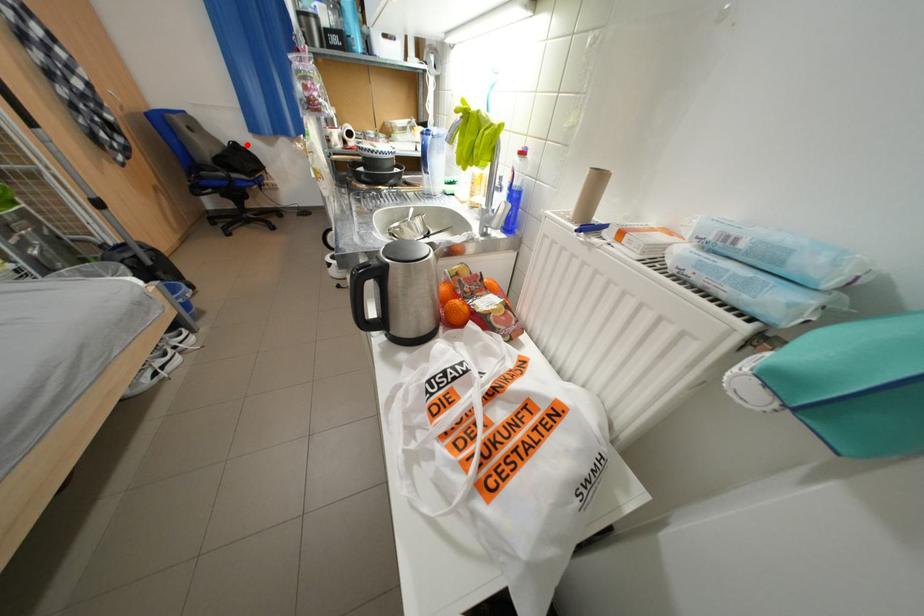
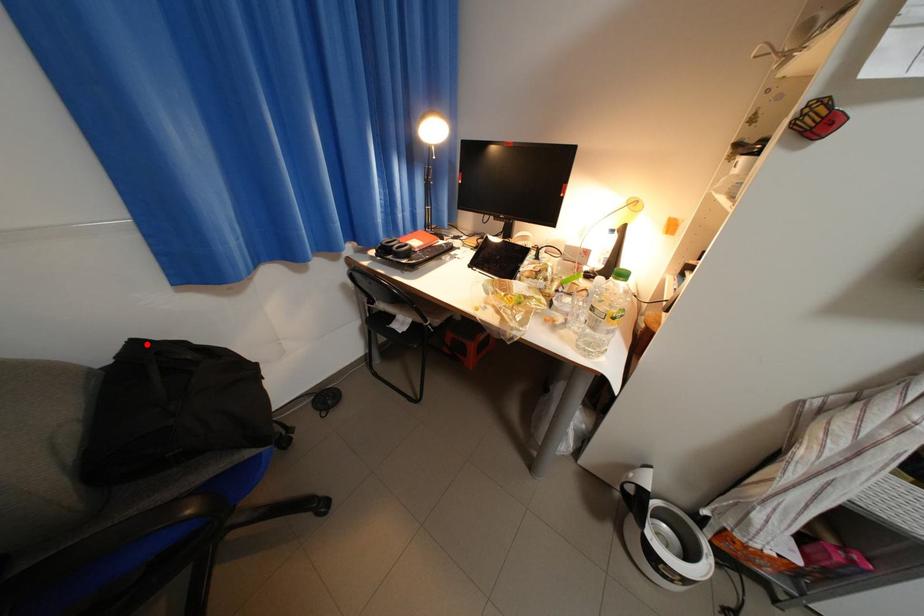
From the picture: I am providing you with two images of the same scene from different viewpoints. A red point is marked on the first image and another point is marked on the second image. Are the points marked in image1 and image2 representing the same 3D position?

Yes